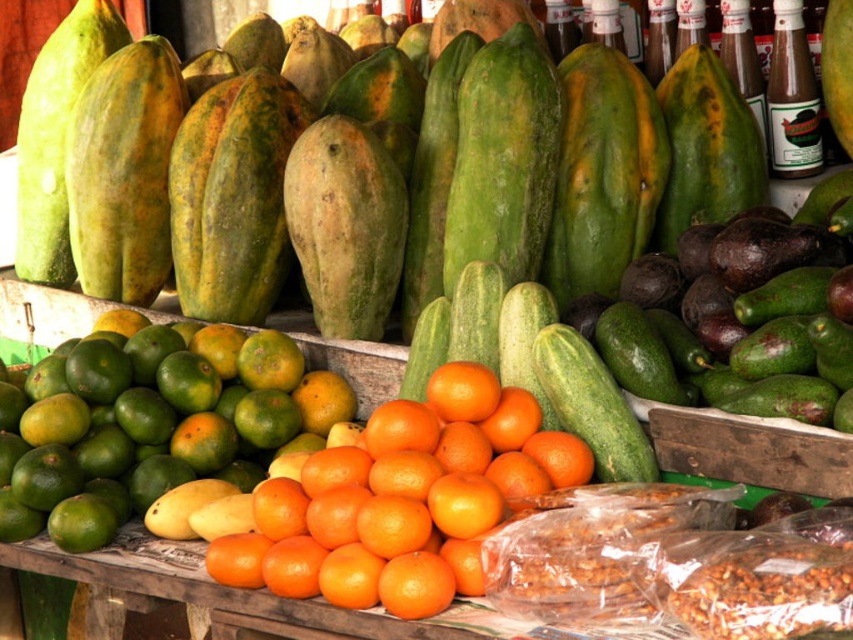
Is orangesmoothorange at center below green matte avocado at right?

Correct, orangesmoothorange at center is located below green matte avocado at right.

Does orangesmoothorange at center have a greater height compared to green matte avocado at right?

No, orangesmoothorange at center is not taller than green matte avocado at right.

Describe the element at coordinates (402, 499) in the screenshot. The width and height of the screenshot is (853, 640). I see `orangesmoothorange at center` at that location.

You are a GUI agent. You are given a task and a screenshot of the screen. Output one action in this format:
    pyautogui.click(x=<x>, y=<y>)
    Task: Click on the orangesmoothorange at center
    The height and width of the screenshot is (640, 853).
    Given the screenshot: What is the action you would take?
    tap(402, 499)

Which is below, green matte mangoes at center or orangesmoothorange at center?

orangesmoothorange at center

Does green matte mangoes at center have a lesser width compared to orangesmoothorange at center?

Incorrect, green matte mangoes at center's width is not less than orangesmoothorange at center's.

Between point (61, 532) and point (448, 496), which one is positioned in front?

Point (448, 496) is in front.

Where is `green matte mangoes at center`? green matte mangoes at center is located at coordinates (149, 422).

Is green matte mangoes at center to the right of green matte avocado at right from the viewer's perspective?

No, green matte mangoes at center is not to the right of green matte avocado at right.

Measure the distance between green matte mangoes at center and camera.

A distance of 2.33 meters exists between green matte mangoes at center and camera.

Where is `green matte mangoes at center`? This screenshot has width=853, height=640. green matte mangoes at center is located at coordinates (149, 422).